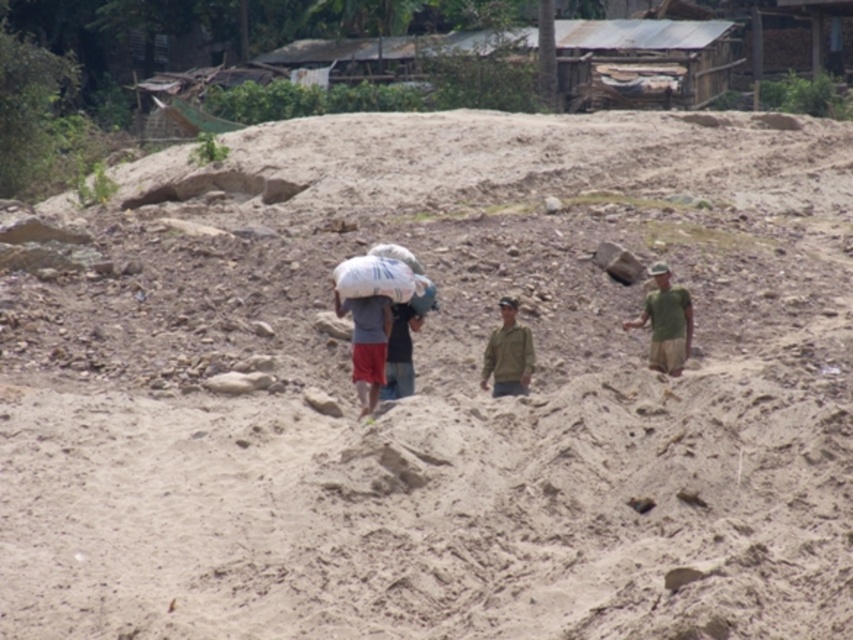
Question: Is green fabric shirt at right smaller than green matte jacket at center?

Choices:
 (A) yes
 (B) no

Answer: (B)

Question: Which point is closer to the camera?

Choices:
 (A) green matte hat at center
 (B) green fabric cap at center

Answer: (B)

Question: Is green fabric shirt at right in front of green matte jacket at center?

Choices:
 (A) no
 (B) yes

Answer: (A)

Question: Considering the real-world distances, which object is farthest from the green matte hat at center?

Choices:
 (A) green fabric cap at center
 (B) green fabric shirt at right
 (C) green matte jacket at center

Answer: (C)

Question: Which of the following is the closest to the observer?

Choices:
 (A) (659, 282)
 (B) (672, 291)
 (C) (512, 314)
 (D) (502, 300)

Answer: (D)

Question: Is green matte jacket at center positioned behind green matte hat at center?

Choices:
 (A) yes
 (B) no

Answer: (B)